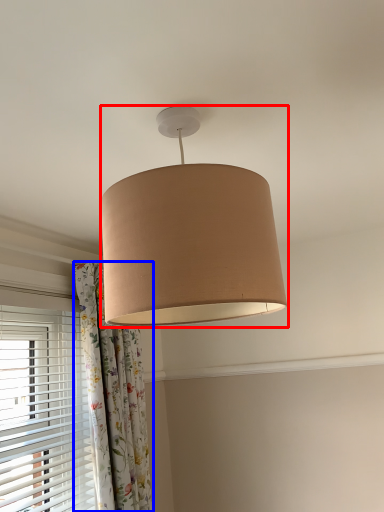
Question: Which object is further to the camera taking this photo, lamp (highlighted by a red box) or curtain (highlighted by a blue box)?

Choices:
 (A) lamp
 (B) curtain

Answer: (B)